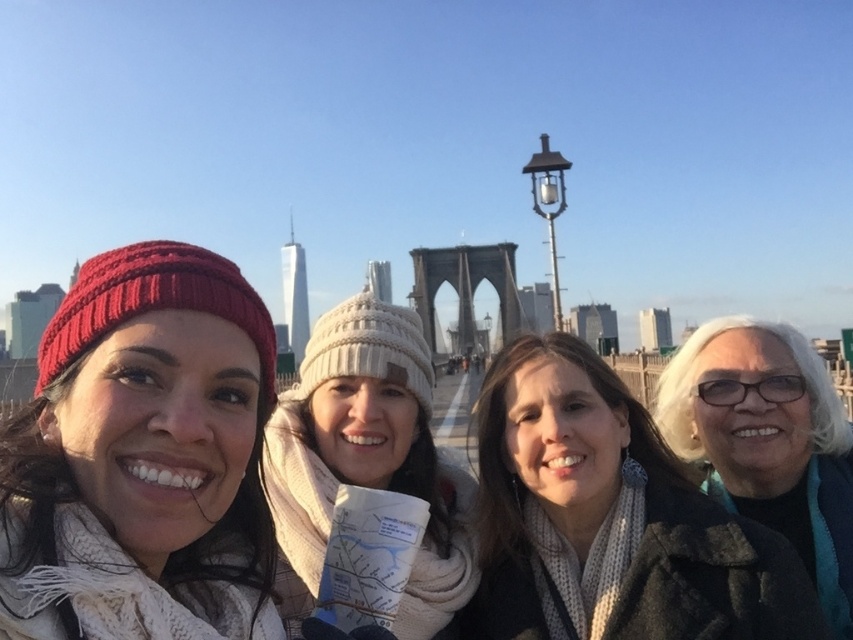
Looking at this image, you are standing in the scene and want to locate the white knitted hat at center. What are its coordinates?

The white knitted hat at center is located at coordinates point (367, 460).

In the scene of four people taking a selfie at the Brooklyn Bridge, you notice the knitted red beanie at left and the white glossy coat at lower right. Which of these two items is positioned further to the left?

The knitted red beanie at left is positioned further to the left compared to the white glossy coat at lower right.